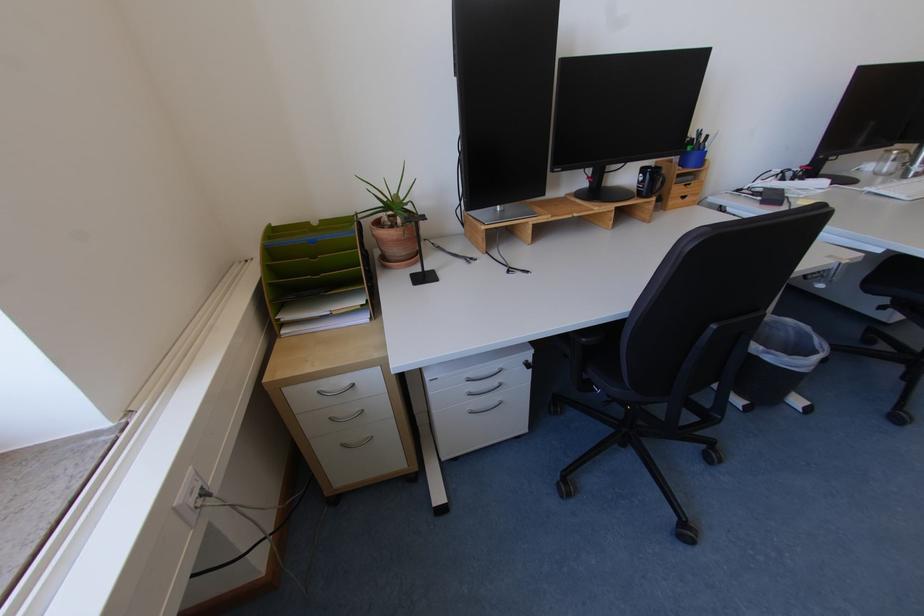
The image size is (924, 616). What do you see at coordinates (190, 496) in the screenshot? I see `the white power plug` at bounding box center [190, 496].